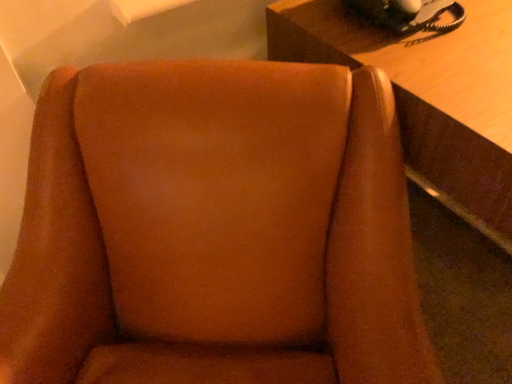
Question: From the image's perspective, relative to wooden table at upper right, is brown suede chair at center above or below?

Choices:
 (A) above
 (B) below

Answer: (B)

Question: Looking at their shapes, would you say brown suede chair at center is wider or thinner than wooden table at upper right?

Choices:
 (A) wide
 (B) thin

Answer: (B)

Question: Which of these objects is positioned farthest from the black rubberized phone at upper right?

Choices:
 (A) brown suede chair at center
 (B) wooden table at upper right

Answer: (A)

Question: Which object is positioned closest to the black rubberized phone at upper right?

Choices:
 (A) wooden table at upper right
 (B) brown suede chair at center

Answer: (A)